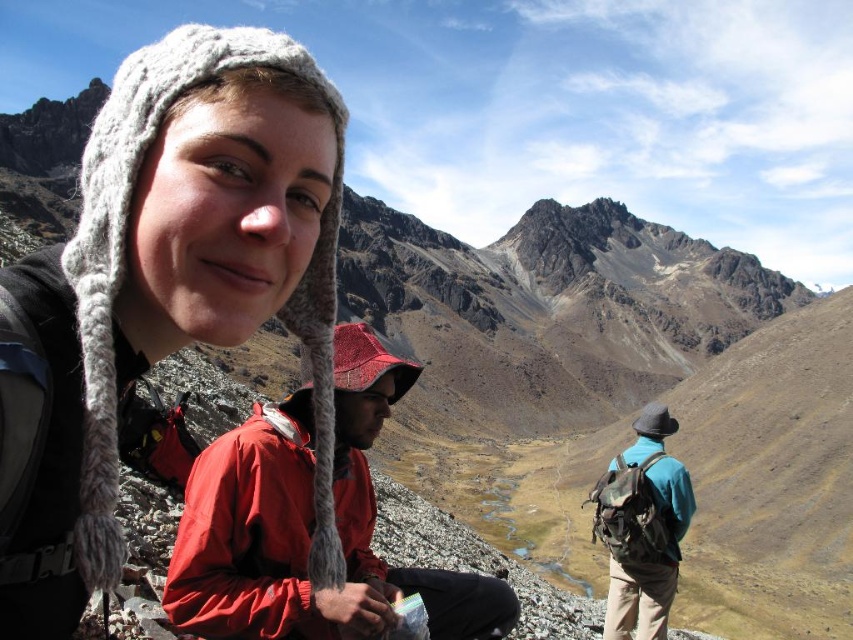
Question: Which point is closer to the camera taking this photo?

Choices:
 (A) (99, 305)
 (B) (508, 596)

Answer: (A)

Question: Which point is closer to the camera taking this photo?

Choices:
 (A) (526, 426)
 (B) (653, 477)
 (C) (265, 51)

Answer: (C)

Question: Is rugged stone mountain at upper center to the left of red waterproof jacket at center from the viewer's perspective?

Choices:
 (A) yes
 (B) no

Answer: (B)

Question: Estimate the real-world distances between objects in this image. Which object is farther from the knitted wool hat at upper left?

Choices:
 (A) rugged stone mountain at upper center
 (B) red waterproof jacket at center

Answer: (A)

Question: Is rugged stone mountain at upper center positioned behind teal fabric backpack at right?

Choices:
 (A) no
 (B) yes

Answer: (B)

Question: Can you confirm if knitted wool hat at upper left is positioned to the left of red waterproof jacket at center?

Choices:
 (A) yes
 (B) no

Answer: (A)